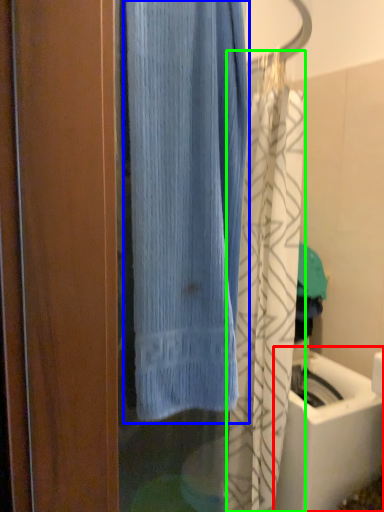
Question: Which object is the closest to the sink (highlighted by a red box)? Choose among these: curtain (highlighted by a blue box) or shower curtain (highlighted by a green box).

Choices:
 (A) curtain
 (B) shower curtain

Answer: (B)